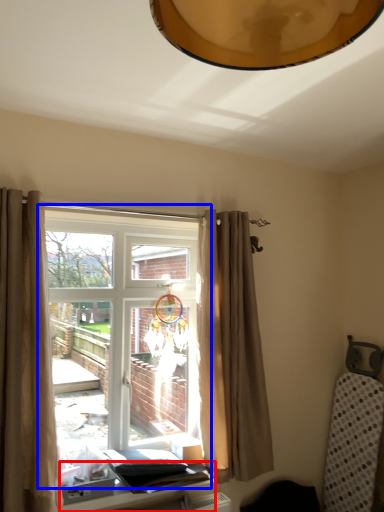
Question: Which object is further to the camera taking this photo, table (highlighted by a red box) or window (highlighted by a blue box)?

Choices:
 (A) table
 (B) window

Answer: (B)